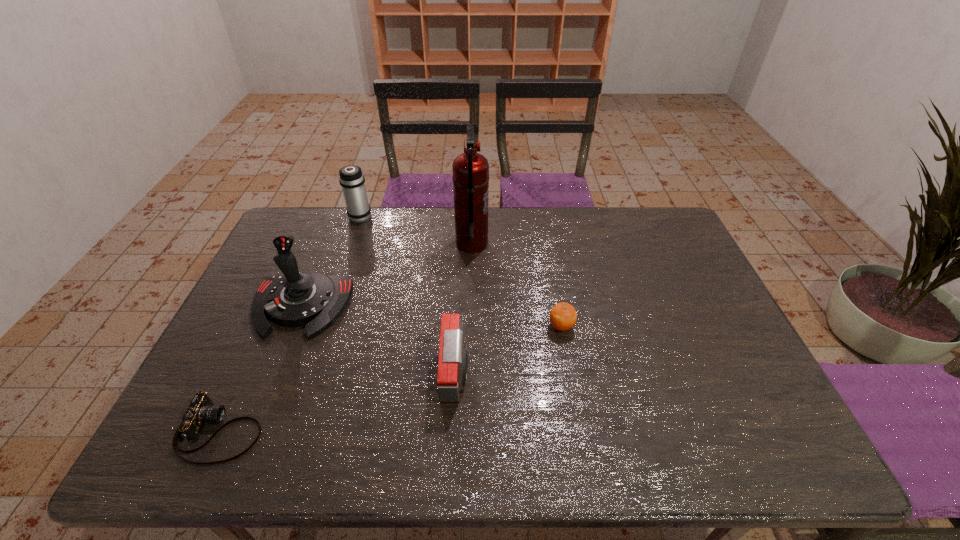
Identify the location of the fifth nearest object. The image size is (960, 540). (470, 177).

At what (x,y) coordinates should I click in order to perform the action: click on fire extinguisher. Please return your answer as a coordinate pair (x, y). The height and width of the screenshot is (540, 960). Looking at the image, I should click on (470, 177).

Locate an element on the screen. The width and height of the screenshot is (960, 540). joystick is located at coordinates (294, 299).

You are a GUI agent. You are given a task and a screenshot of the screen. Output one action in this format:
    pyautogui.click(x=<x>, y=<y>)
    Task: Click on the thermos bottle
    
    Given the screenshot: What is the action you would take?
    pos(352,180)

You are a GUI agent. You are given a task and a screenshot of the screen. Output one action in this format:
    pyautogui.click(x=<x>, y=<y>)
    Task: Click on the fourth tallest object
    The height and width of the screenshot is (540, 960).
    Given the screenshot: What is the action you would take?
    pyautogui.click(x=453, y=361)

At what (x,y) coordinates should I click in order to perform the action: click on the right camera. Please return your answer as a coordinate pair (x, y). This screenshot has height=540, width=960. Looking at the image, I should click on (453, 361).

Where is `the rightmost object`? the rightmost object is located at coordinates (563, 316).

What are the coordinates of `the fifth tallest object` in the screenshot? It's located at (563, 316).

Where is `the shorter camera`? The width and height of the screenshot is (960, 540). the shorter camera is located at coordinates (201, 410).

This screenshot has width=960, height=540. In order to click on the shortest object in this screenshot , I will do `click(201, 410)`.